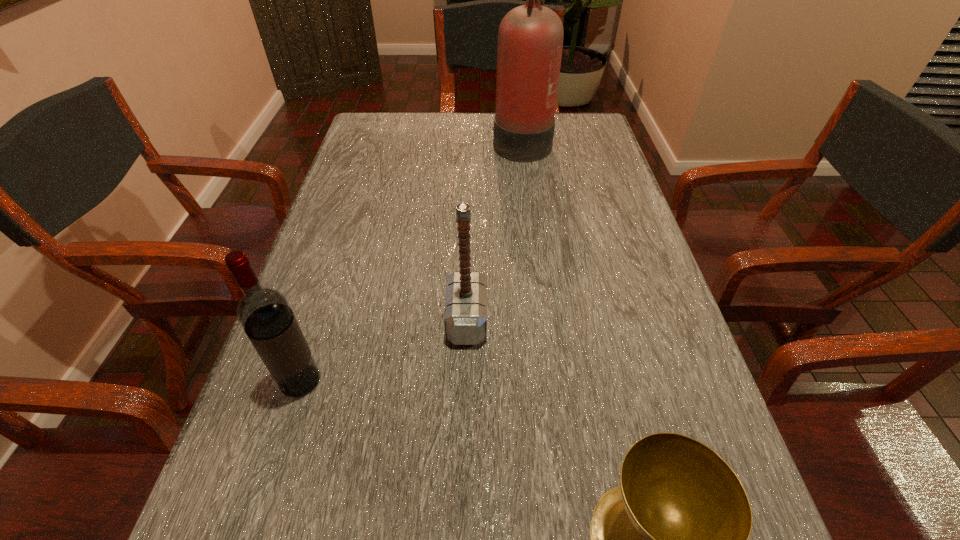
Where is `the farthest object`? The height and width of the screenshot is (540, 960). the farthest object is located at coordinates (530, 40).

Image resolution: width=960 pixels, height=540 pixels. Find the location of `the tallest object`. the tallest object is located at coordinates (530, 40).

In order to click on the leftmost object in this screenshot , I will do `click(264, 313)`.

Find the location of a particular element. wine bottle is located at coordinates (264, 313).

Identify the location of hammer. (465, 315).

Find the location of a particular element. the third object from right to left is located at coordinates (465, 315).

You are a GUI agent. You are given a task and a screenshot of the screen. Output one action in this format:
    pyautogui.click(x=<x>, y=<y>)
    Task: Click on the vacant space located 0.250m at the nozzle of the tallest object
    This screenshot has width=960, height=540.
    Given the screenshot: What is the action you would take?
    pyautogui.click(x=410, y=140)

Image resolution: width=960 pixels, height=540 pixels. I want to click on vacant space situated at the nozzle of the tallest object, so click(400, 140).

This screenshot has width=960, height=540. In order to click on free location located at the nozzle of the tallest object in this screenshot , I will do `click(396, 140)`.

Locate an element on the screen. blank space located on the back of the third farthest object is located at coordinates (321, 320).